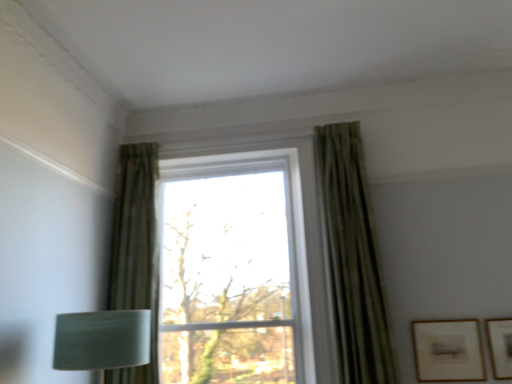
Question: Is matte gold picture frame at lower right, the first picture frame positioned from the left, not close to transparent glass window at center?

Choices:
 (A) yes
 (B) no

Answer: (A)

Question: Is matte gold picture frame at lower right, the first picture frame positioned from the left, positioned beyond the bounds of transparent glass window at center?

Choices:
 (A) yes
 (B) no

Answer: (A)

Question: From a real-world perspective, is matte gold picture frame at lower right, the second picture frame viewed from the right, on top of transparent glass window at center?

Choices:
 (A) yes
 (B) no

Answer: (B)

Question: From the image's perspective, is matte gold picture frame at lower right, the first picture frame positioned from the left, below transparent glass window at center?

Choices:
 (A) yes
 (B) no

Answer: (A)

Question: Considering the relative sizes of matte gold picture frame at lower right, the first picture frame positioned from the left, and transparent glass window at center in the image provided, is matte gold picture frame at lower right, the first picture frame positioned from the left, taller than transparent glass window at center?

Choices:
 (A) no
 (B) yes

Answer: (A)

Question: Is green textured curtain at upper right, the 2th curtain from the left, in front of or behind green textured curtain at left, marked as the 1th curtain in a left-to-right arrangement, in the image?

Choices:
 (A) behind
 (B) front

Answer: (B)

Question: Based on their positions, is green textured curtain at upper right, which is the 1th curtain from right to left, located to the left or right of green textured curtain at left, acting as the second curtain starting from the right?

Choices:
 (A) left
 (B) right

Answer: (B)

Question: From the image's perspective, is green textured curtain at upper right, the 2th curtain from the left, above or below green textured curtain at left, marked as the 1th curtain in a left-to-right arrangement?

Choices:
 (A) above
 (B) below

Answer: (A)

Question: Looking at their shapes, would you say green textured curtain at upper right, which is the 1th curtain from right to left, is wider or thinner than green textured curtain at left, acting as the second curtain starting from the right?

Choices:
 (A) thin
 (B) wide

Answer: (A)

Question: Is matte gold picture frame at lower right, the second picture frame viewed from the right, to the left or to the right of green textured curtain at left, marked as the 1th curtain in a left-to-right arrangement, in the image?

Choices:
 (A) right
 (B) left

Answer: (A)

Question: In terms of size, does matte gold picture frame at lower right, the first picture frame positioned from the left, appear bigger or smaller than green textured curtain at left, acting as the second curtain starting from the right?

Choices:
 (A) small
 (B) big

Answer: (A)

Question: From the image's perspective, is matte gold picture frame at lower right, the second picture frame viewed from the right, above or below green textured curtain at left, marked as the 1th curtain in a left-to-right arrangement?

Choices:
 (A) above
 (B) below

Answer: (B)

Question: Considering the positions of point (434, 377) and point (138, 198), is point (434, 377) closer or farther from the camera than point (138, 198)?

Choices:
 (A) farther
 (B) closer

Answer: (B)

Question: From a real-world perspective, is transparent glass window at center above or below matte gold picture frame at lower right, arranged as the 1th picture frame when viewed from the right?

Choices:
 (A) below
 (B) above

Answer: (B)

Question: Would you say transparent glass window at center is to the left or to the right of matte gold picture frame at lower right, positioned as the 2th picture frame in left-to-right order, in the picture?

Choices:
 (A) right
 (B) left

Answer: (B)